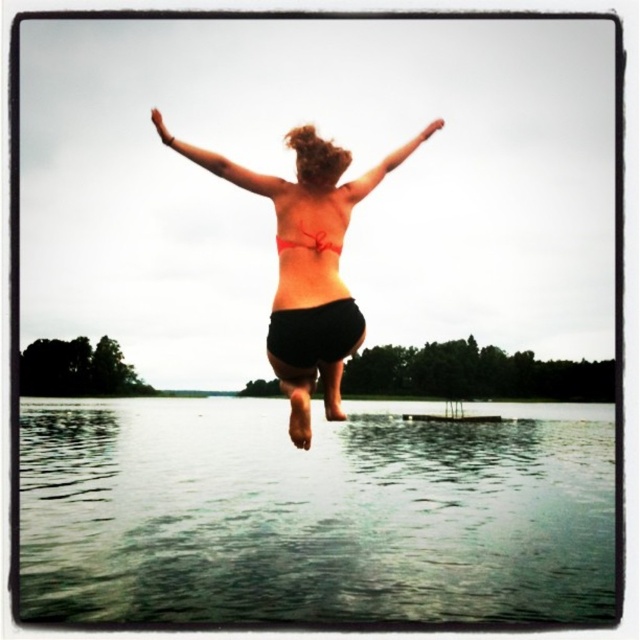
You are a swimwear designer observing the image. You need to determine which bikini top has a wider silhouette between the matte orange bikini top at upper center and the matte white bikini top at upper center. Which one should you recommend if the client prefers a more voluminous look?

The matte orange bikini top at upper center has a larger width than the matte white bikini top at upper center, so it would be the better recommendation for a more voluminous look.

You are a photographer capturing the scene of a person jumping into water. You notice the matte skin arm at upper center and the matte orange bikini top at upper center. Which object is closer to the camera?

The matte skin arm at upper center is closer to the camera because it is in front of the matte orange bikini top at upper center.

You are standing at the edge of the water and want to reach the point marked as point (220, 168). If you can jump 10 meters, will you be able to reach it?

The distance between you and point (220, 168) is 11.86 meters. Since your jump can only reach 10 meters, you won not be able to reach it.